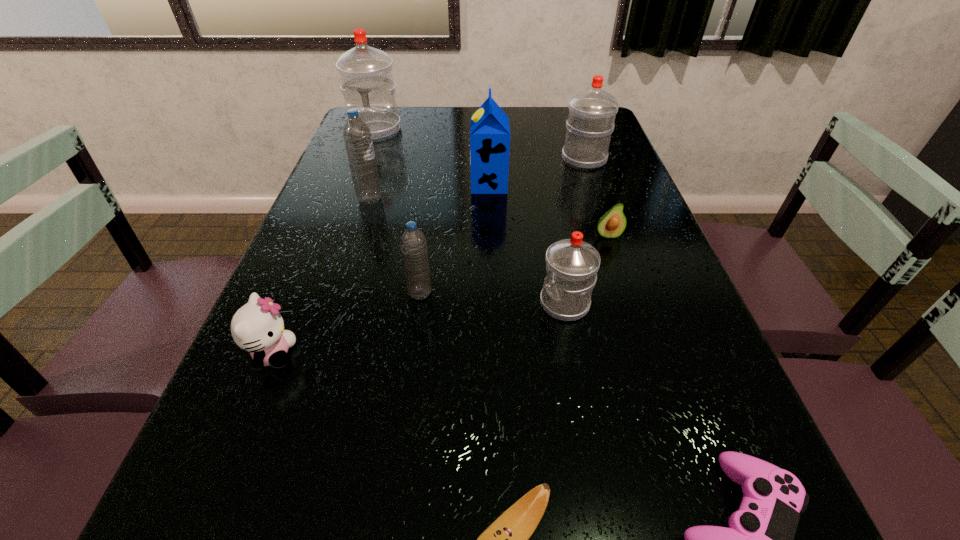
Locate an element on the screen. vacant position in the image that satisfies the following two spatial constraints: 1. on the cut side of the green avocado; 2. on the handle side of the smallest white water bottle is located at coordinates (631, 304).

I want to click on free region that satisfies the following two spatial constraints: 1. with the cap open on the carton; 2. on the front side of the farther blue water bottle, so (490, 199).

Where is `vacant space that satisfies the following two spatial constraints: 1. on the front side of the farther blue water bottle; 2. on the front-facing side of the seventh tallest object`? The width and height of the screenshot is (960, 540). vacant space that satisfies the following two spatial constraints: 1. on the front side of the farther blue water bottle; 2. on the front-facing side of the seventh tallest object is located at coordinates (322, 354).

The image size is (960, 540). I want to click on vacant space that satisfies the following two spatial constraints: 1. with the cap open on the blue carton; 2. on the front side of the bigger blue water bottle, so click(x=490, y=199).

The width and height of the screenshot is (960, 540). I want to click on vacant space that satisfies the following two spatial constraints: 1. on the front side of the bigger blue water bottle; 2. on the left side of the fourth object from left to right, so click(x=340, y=293).